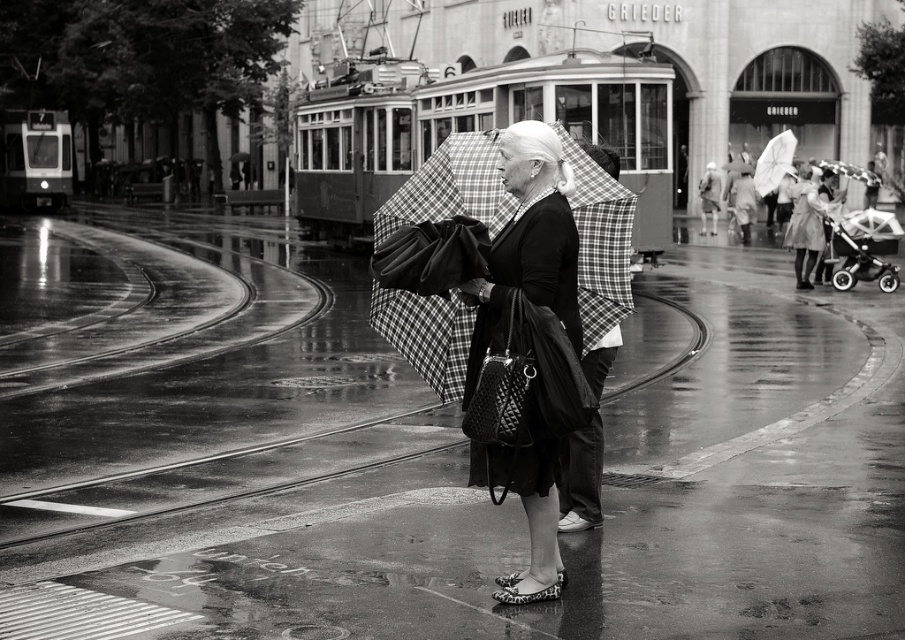
Question: Which of the following is the farthest from the observer?

Choices:
 (A) (779, 145)
 (B) (788, 483)
 (C) (472, 166)
 (D) (880, 232)

Answer: (A)

Question: Is matte black dress at center to the right of metallic stroller at right from the viewer's perspective?

Choices:
 (A) no
 (B) yes

Answer: (A)

Question: Which of the following is the farthest from the observer?

Choices:
 (A) (487, 362)
 (B) (832, 273)
 (C) (397, 227)

Answer: (B)

Question: Does matte black dress at center appear on the left side of metallic stroller at right?

Choices:
 (A) no
 (B) yes

Answer: (B)

Question: Observing the image, what is the correct spatial positioning of matte black dress at center in reference to plaid fabric umbrella at center?

Choices:
 (A) below
 (B) above

Answer: (A)

Question: Based on their relative distances, which object is farther from the metallic stroller at right?

Choices:
 (A) matte black dress at center
 (B) plaid fabric umbrella at center

Answer: (A)